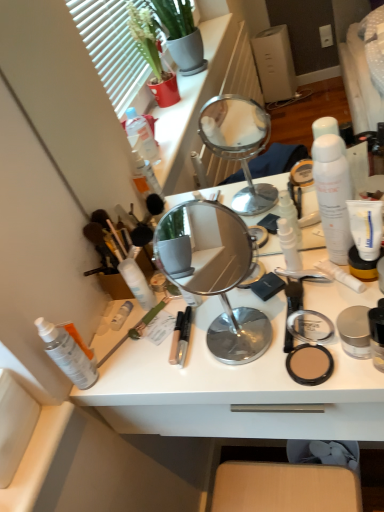
The image size is (384, 512). I want to click on vacant space that is in between matte beige compact at right and white matte lotion at center, which is counted as the 4th toiletry, starting from the right, so pyautogui.click(x=206, y=344).